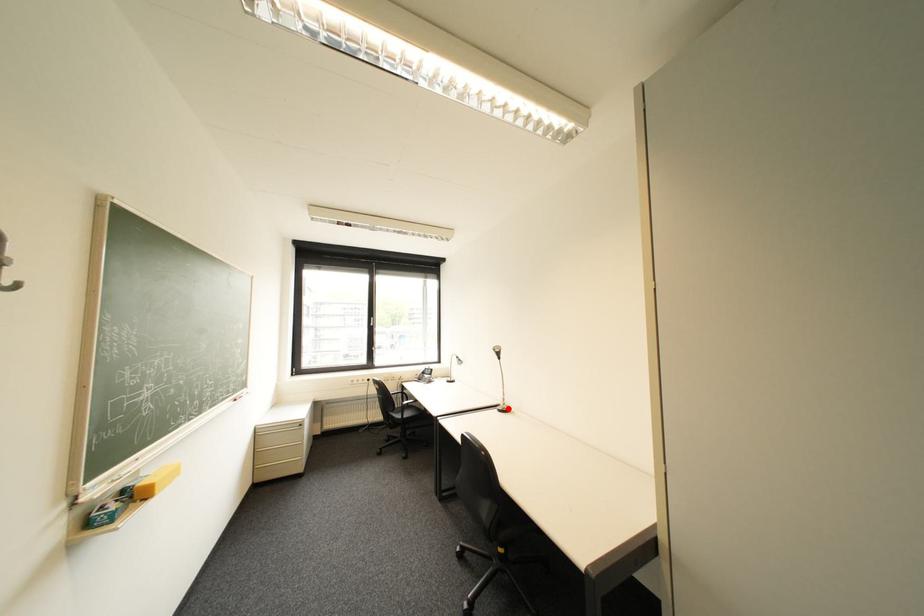
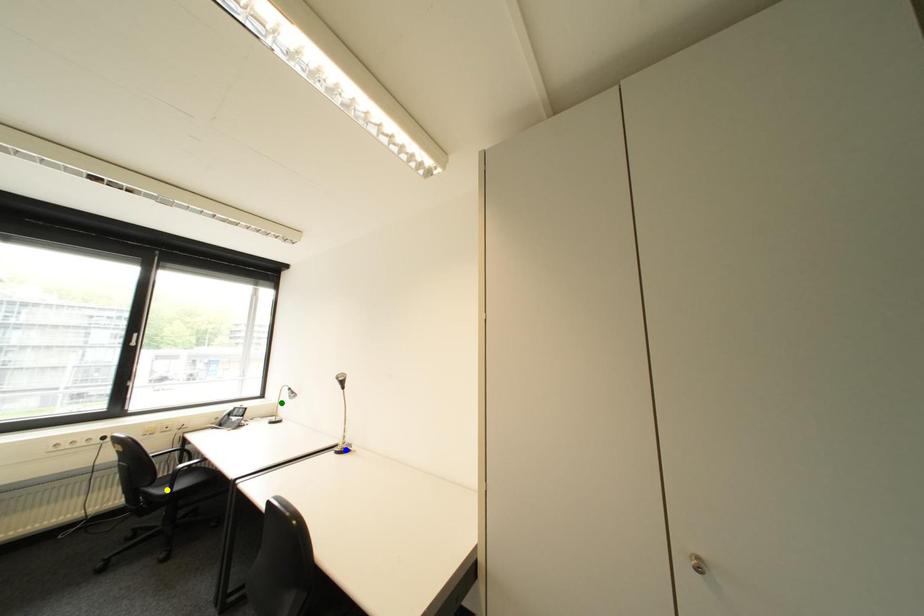
Question: I am providing you with two images of the same scene from different viewpoints. A red point is marked on the first image. You are given multiple points on the second image. Which spot in image 2 lines up with the point in image 1?

Choices:
 (A) blue point
 (B) yellow point
 (C) green point

Answer: (A)